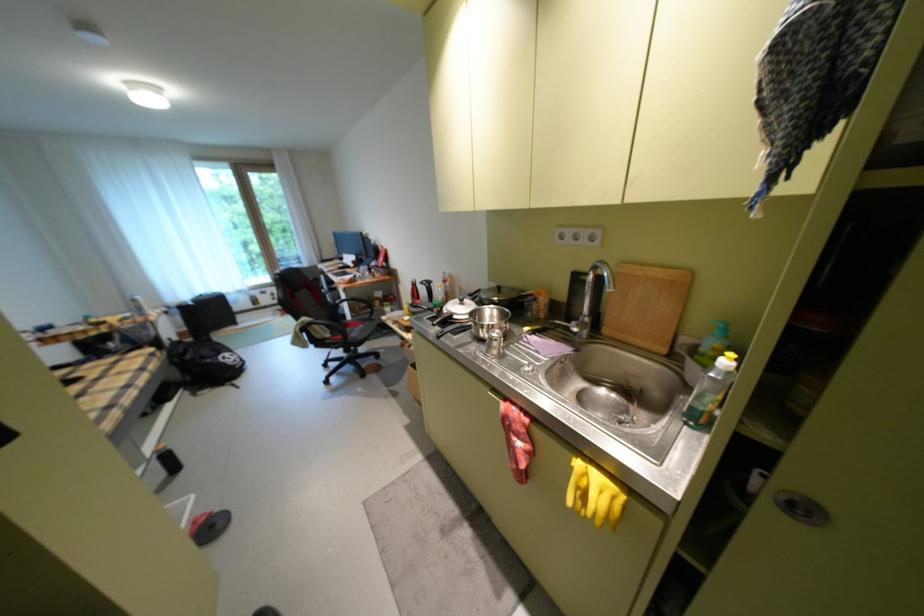
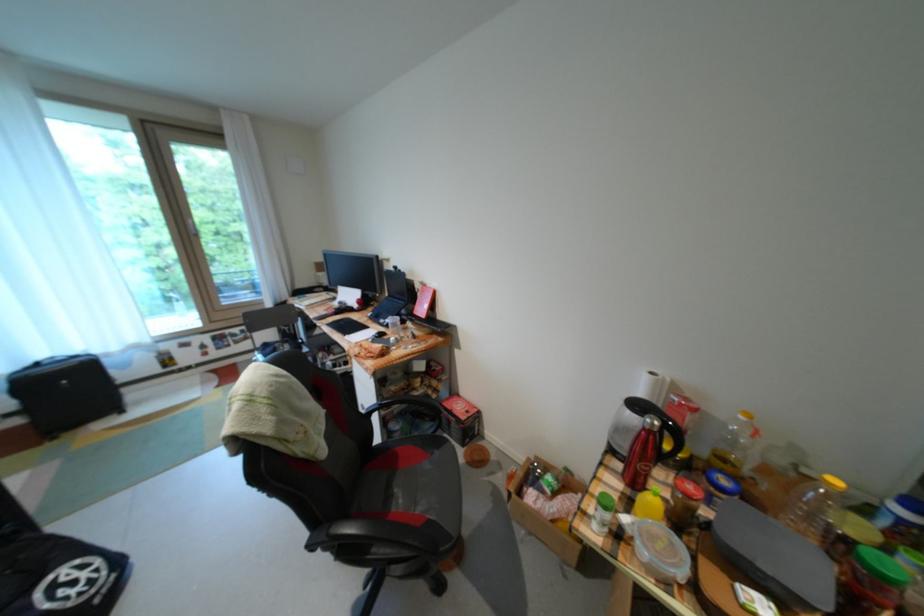
The point at (x=378, y=323) is marked in the first image. Where is the corresponding point in the second image?

(446, 455)